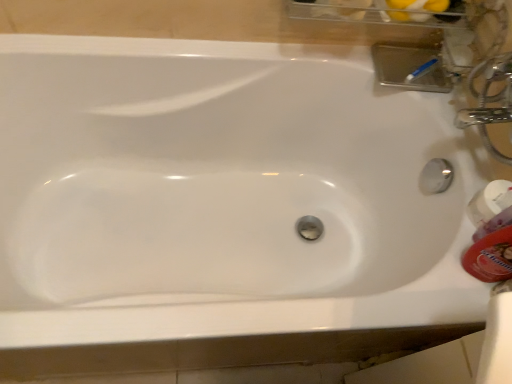
Question: In terms of width, does white glossy mouthwash at right, acting as the second mouthwash starting from the front, look wider or thinner when compared to orange plastic mouthwash at right, the first mouthwash viewed from the front?

Choices:
 (A) thin
 (B) wide

Answer: (B)

Question: Does point (510, 218) appear closer or farther from the camera than point (503, 261)?

Choices:
 (A) farther
 (B) closer

Answer: (A)

Question: In the image, is white glossy mouthwash at right, acting as the second mouthwash starting from the front, on the left side or the right side of orange plastic mouthwash at right, acting as the second mouthwash starting from the back?

Choices:
 (A) right
 (B) left

Answer: (A)

Question: From their relative heights in the image, would you say orange plastic mouthwash at right, the first mouthwash viewed from the front, is taller or shorter than white glossy mouthwash at right, acting as the second mouthwash starting from the front?

Choices:
 (A) short
 (B) tall

Answer: (B)

Question: Visually, is orange plastic mouthwash at right, the first mouthwash viewed from the front, positioned to the left or to the right of white glossy mouthwash at right, the first mouthwash positioned from the back?

Choices:
 (A) left
 (B) right

Answer: (A)

Question: Is orange plastic mouthwash at right, acting as the second mouthwash starting from the back, situated inside white glossy mouthwash at right, the first mouthwash positioned from the back, or outside?

Choices:
 (A) outside
 (B) inside

Answer: (A)

Question: Is orange plastic mouthwash at right, acting as the second mouthwash starting from the back, in front of or behind white glossy mouthwash at right, acting as the second mouthwash starting from the front, in the image?

Choices:
 (A) behind
 (B) front

Answer: (B)